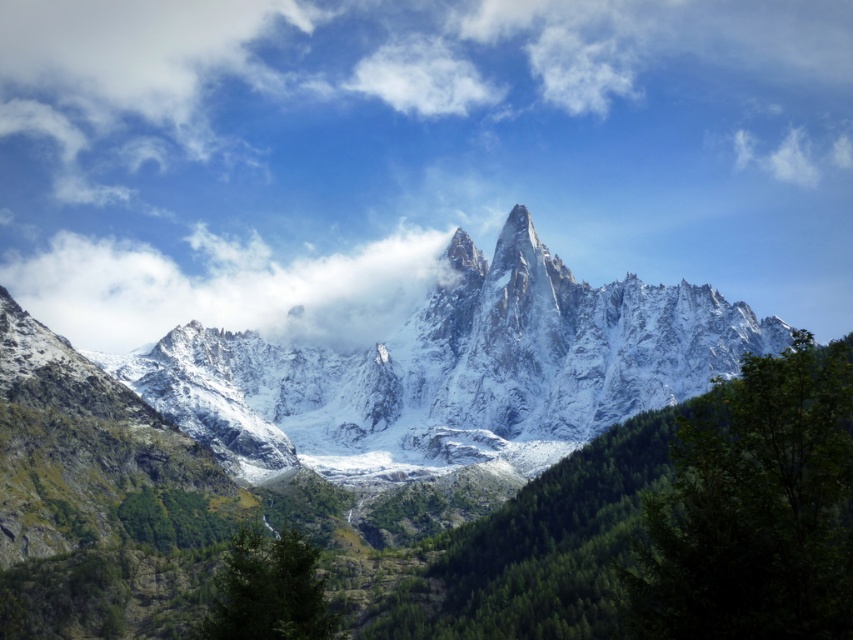
Question: Estimate the real-world distances between objects in this image. Which object is closer to the green leafy tree at lower right?

Choices:
 (A) green matte tree at lower center
 (B) white fluffy cloud at center
 (C) snowy granite mountain range at center

Answer: (A)

Question: Observing the image, what is the correct spatial positioning of green leafy tree at lower right in reference to green matte tree at lower center?

Choices:
 (A) right
 (B) left

Answer: (A)

Question: Which point is farther from the camera taking this photo?

Choices:
 (A) (88, 333)
 (B) (677, 579)
 (C) (241, 637)
 (D) (154, 394)

Answer: (A)

Question: Can you confirm if snowy granite mountain range at center is wider than white fluffy cloud at center?

Choices:
 (A) yes
 (B) no

Answer: (A)

Question: Which object is farther from the camera taking this photo?

Choices:
 (A) white fluffy cloud at center
 (B) green matte tree at lower center
 (C) green leafy tree at lower right
 (D) snowy granite mountain range at center

Answer: (A)

Question: Does snowy granite mountain range at center have a larger size compared to white fluffy cloud at center?

Choices:
 (A) yes
 (B) no

Answer: (A)